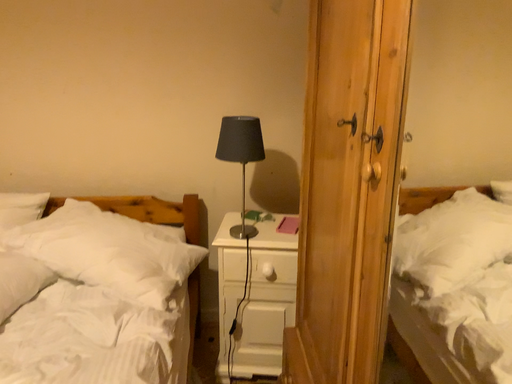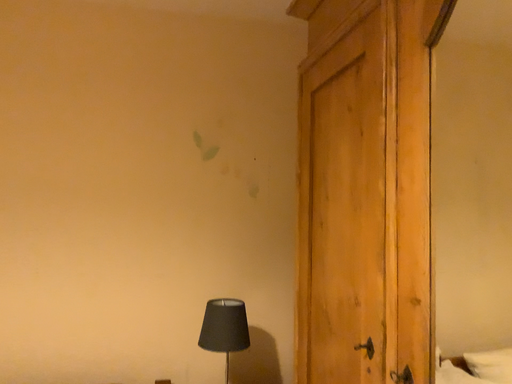
Question: Which way did the camera rotate in the video?

Choices:
 (A) rotated downward
 (B) rotated upward

Answer: (B)